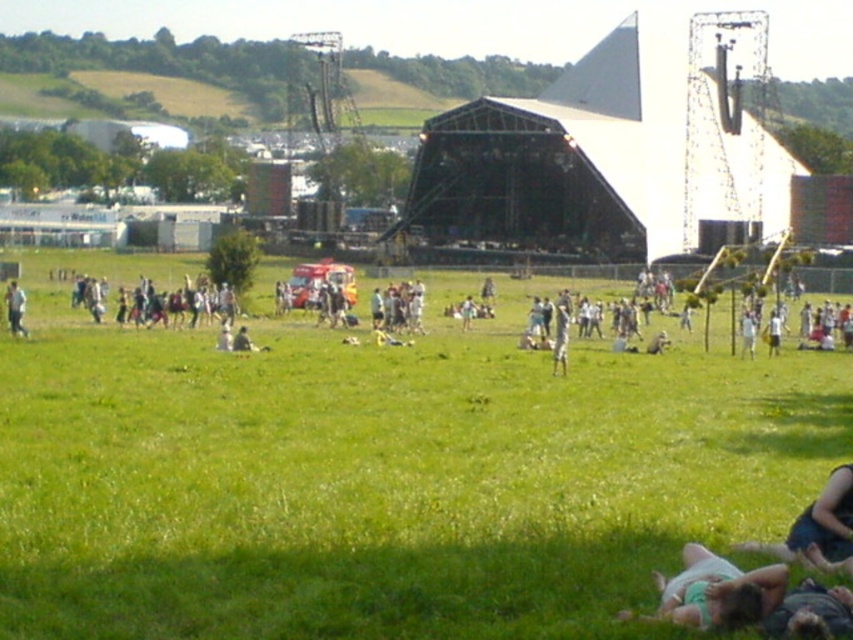
Question: Can you confirm if white cotton shirt at center is positioned above light brown fabric pants at lower left?

Choices:
 (A) no
 (B) yes

Answer: (B)

Question: Which point appears closest to the camera in this image?

Choices:
 (A) (717, 556)
 (B) (811, 300)

Answer: (A)

Question: Among these objects, which one is nearest to the camera?

Choices:
 (A) green fabric person at lower right
 (B) white cotton shirt at center

Answer: (A)

Question: Does green grassy field at center have a greater width compared to white cotton shirt at center?

Choices:
 (A) no
 (B) yes

Answer: (A)

Question: Based on their relative distances, which object is farther from the green grassy field at center?

Choices:
 (A) white fabric person at center
 (B) green fabric person at lower right
 (C) light brown fabric pants at lower left
 (D) white cotton shirt at center

Answer: (D)

Question: Is white cotton shirt at center above green fabric person at lower right?

Choices:
 (A) no
 (B) yes

Answer: (B)